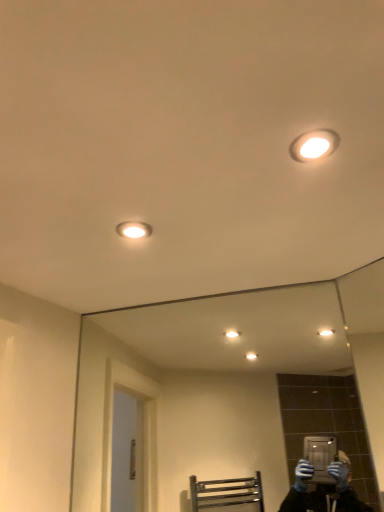
Question: Does matte white light fixture at upper left, acting as the first light fixture starting from the bottom, have a lesser height compared to matte white light fixture at upper right, which ranks as the first light fixture in front-to-back order?

Choices:
 (A) yes
 (B) no

Answer: (B)

Question: Is matte white light fixture at upper left, which ranks as the first light fixture in left-to-right order, facing away from matte white light fixture at upper right, the 2th light fixture from the back?

Choices:
 (A) no
 (B) yes

Answer: (A)

Question: Considering the relative sizes of matte white light fixture at upper left, acting as the first light fixture starting from the bottom, and matte white light fixture at upper right, which is counted as the 1th light fixture, starting from the right, in the image provided, is matte white light fixture at upper left, acting as the first light fixture starting from the bottom, wider than matte white light fixture at upper right, which is counted as the 1th light fixture, starting from the right,?

Choices:
 (A) yes
 (B) no

Answer: (B)

Question: Is matte white light fixture at upper left, which ranks as the 2th light fixture in right-to-left order, positioned behind matte white light fixture at upper right, which is counted as the 1th light fixture, starting from the right?

Choices:
 (A) yes
 (B) no

Answer: (A)

Question: Is the surface of matte white light fixture at upper left, which ranks as the 2th light fixture in right-to-left order, in direct contact with matte white light fixture at upper right, which ranks as the first light fixture in front-to-back order?

Choices:
 (A) yes
 (B) no

Answer: (B)

Question: Considering the relative sizes of matte white light fixture at upper left, positioned as the second light fixture in top-to-bottom order, and matte white light fixture at upper right, positioned as the first light fixture in top-to-bottom order, in the image provided, is matte white light fixture at upper left, positioned as the second light fixture in top-to-bottom order, bigger than matte white light fixture at upper right, positioned as the first light fixture in top-to-bottom order,?

Choices:
 (A) yes
 (B) no

Answer: (A)

Question: Is matte white light fixture at upper right, the 2th light fixture from the back, behind clear glass mirror at center?

Choices:
 (A) no
 (B) yes

Answer: (A)

Question: Considering the relative sizes of matte white light fixture at upper right, which is the second light fixture from bottom to top, and clear glass mirror at center in the image provided, is matte white light fixture at upper right, which is the second light fixture from bottom to top, smaller than clear glass mirror at center?

Choices:
 (A) yes
 (B) no

Answer: (A)

Question: Is matte white light fixture at upper right, positioned as the first light fixture in top-to-bottom order, in contact with clear glass mirror at center?

Choices:
 (A) yes
 (B) no

Answer: (B)

Question: Is matte white light fixture at upper right, which ranks as the first light fixture in front-to-back order, outside clear glass mirror at center?

Choices:
 (A) no
 (B) yes

Answer: (B)

Question: Does matte white light fixture at upper right, the 2th light fixture from the back, come in front of clear glass mirror at center?

Choices:
 (A) yes
 (B) no

Answer: (A)

Question: From the image's perspective, is matte white light fixture at upper right, which is counted as the 1th light fixture, starting from the right, on clear glass mirror at center?

Choices:
 (A) no
 (B) yes

Answer: (B)

Question: Is clear glass mirror at center outside matte white light fixture at upper right, which is counted as the 1th light fixture, starting from the right?

Choices:
 (A) yes
 (B) no

Answer: (A)